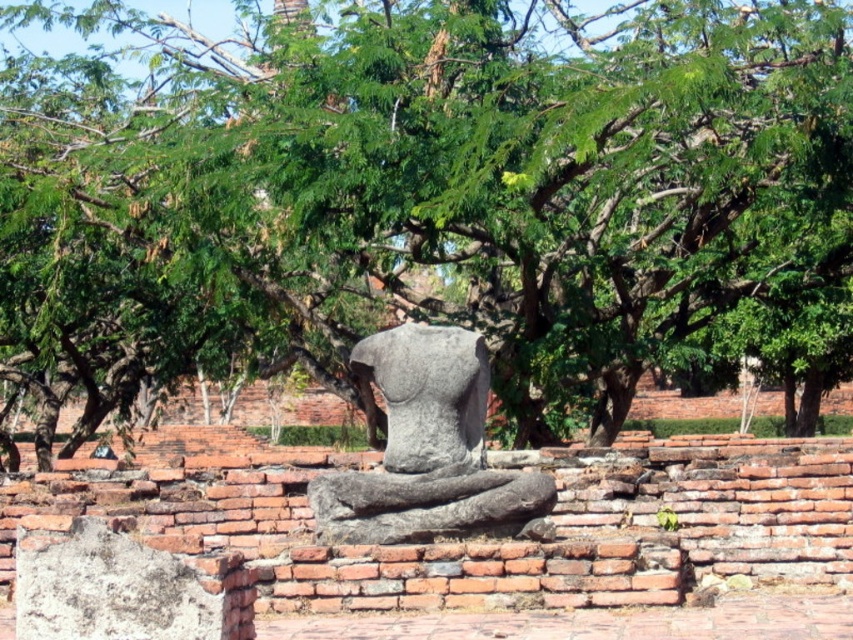
Question: Which point is farther from the camera taking this photo?

Choices:
 (A) (424, 339)
 (B) (579, 80)

Answer: (B)

Question: Can you confirm if green leafy tree at center is positioned to the left of gray stone statue at center?

Choices:
 (A) yes
 (B) no

Answer: (A)

Question: Is green leafy tree at center positioned in front of gray stone statue at center?

Choices:
 (A) no
 (B) yes

Answer: (A)

Question: Which point is closer to the camera?

Choices:
 (A) gray stone statue at center
 (B) green leafy tree at center

Answer: (A)

Question: Is green leafy tree at center smaller than gray stone statue at center?

Choices:
 (A) yes
 (B) no

Answer: (B)